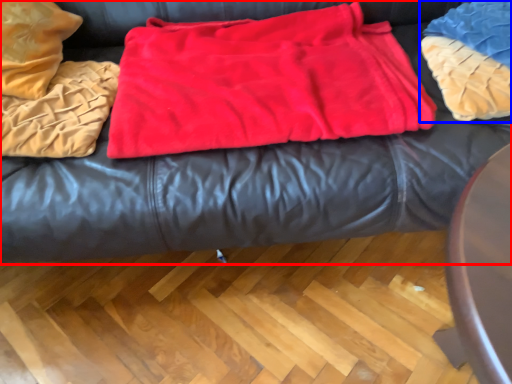
Question: Among these objects, which one is nearest to the camera, furniture (highlighted by a red box) or cloth (highlighted by a blue box)?

Choices:
 (A) furniture
 (B) cloth

Answer: (A)